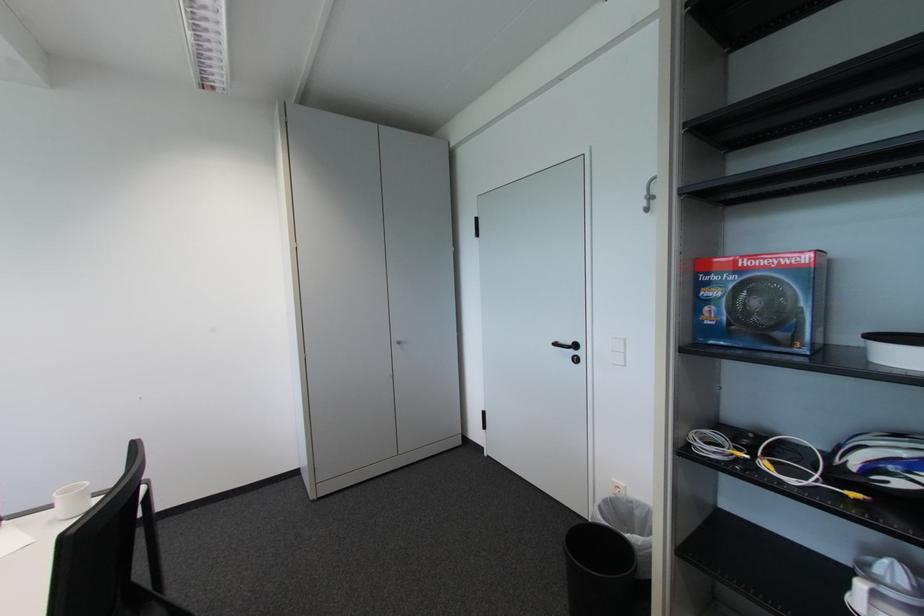
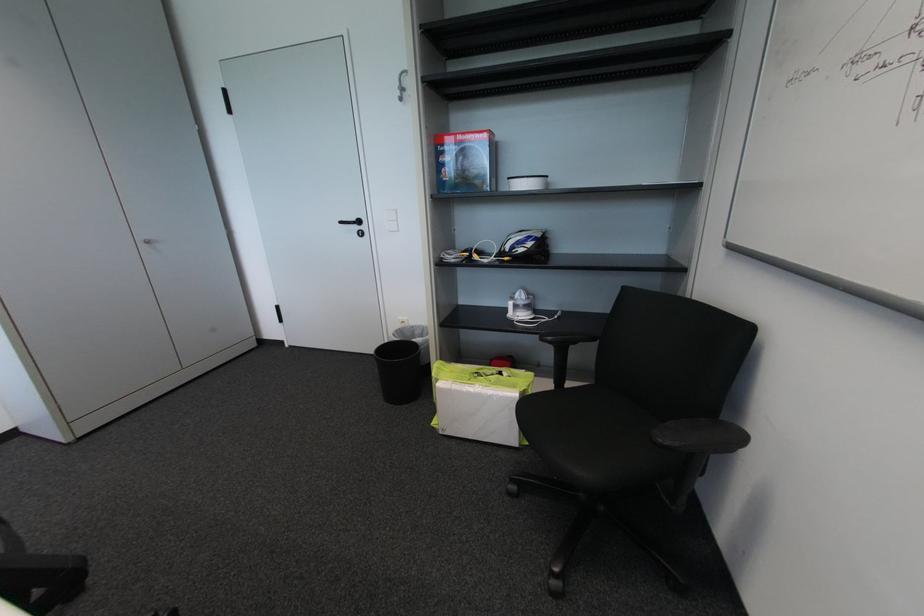
In the second image, find the point that corresponds to pixel 750 264 in the first image.

(466, 139)